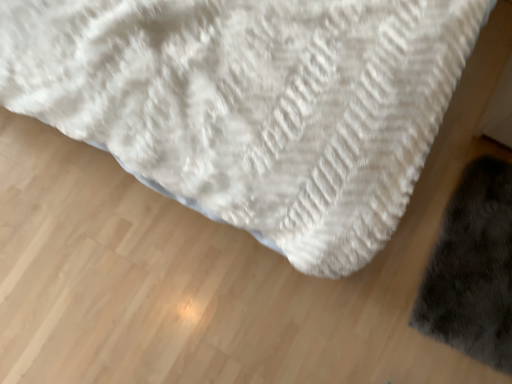
This screenshot has width=512, height=384. What are the coordinates of `vacant space underneath dark gray fluffy mat at lower right (from a real-world perspective)` in the screenshot? It's located at (476, 261).